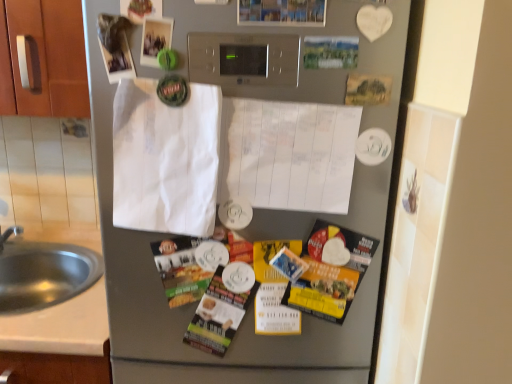
Question: Can you confirm if yellow paper flyer at lower right is taller than brushed metal sink at lower left?

Choices:
 (A) no
 (B) yes

Answer: (B)

Question: Is yellow paper flyer at lower right looking in the opposite direction of brushed metal sink at lower left?

Choices:
 (A) yes
 (B) no

Answer: (B)

Question: Is yellow paper flyer at lower right to the right of brushed metal sink at lower left from the viewer's perspective?

Choices:
 (A) yes
 (B) no

Answer: (A)

Question: From a real-world perspective, does yellow paper flyer at lower right sit lower than brushed metal sink at lower left?

Choices:
 (A) no
 (B) yes

Answer: (A)

Question: Does yellow paper flyer at lower right have a larger size compared to brushed metal sink at lower left?

Choices:
 (A) yes
 (B) no

Answer: (B)

Question: In terms of width, does matte plastic magazine at center, positioned as the first magazine in right-to-left order, look wider or thinner when compared to matte paper magazine at center, placed as the first magazine when sorted from left to right?

Choices:
 (A) thin
 (B) wide

Answer: (B)

Question: Is matte plastic magazine at center, positioned as the first magazine in right-to-left order, bigger or smaller than matte paper magazine at center, the second magazine when ordered from right to left?

Choices:
 (A) big
 (B) small

Answer: (A)

Question: From the image's perspective, is matte plastic magazine at center, marked as the second magazine in a left-to-right arrangement, positioned above or below matte paper magazine at center, placed as the first magazine when sorted from left to right?

Choices:
 (A) below
 (B) above

Answer: (A)

Question: From a real-world perspective, is matte plastic magazine at center, marked as the second magazine in a left-to-right arrangement, above or below matte paper magazine at center, the second magazine when ordered from right to left?

Choices:
 (A) below
 (B) above

Answer: (A)

Question: Considering the positions of yellow paper flyer at lower right and brushed metal sink at lower left in the image, is yellow paper flyer at lower right taller or shorter than brushed metal sink at lower left?

Choices:
 (A) short
 (B) tall

Answer: (B)

Question: Do you think yellow paper flyer at lower right is within brushed metal sink at lower left, or outside of it?

Choices:
 (A) outside
 (B) inside

Answer: (A)

Question: From a real-world perspective, is yellow paper flyer at lower right physically located above or below brushed metal sink at lower left?

Choices:
 (A) above
 (B) below

Answer: (A)

Question: Looking at their shapes, would you say yellow paper flyer at lower right is wider or thinner than brushed metal sink at lower left?

Choices:
 (A) thin
 (B) wide

Answer: (A)

Question: Considering their positions, is matte plastic magazine at center, positioned as the first magazine in right-to-left order, located in front of or behind satin silver refrigerator at center?

Choices:
 (A) behind
 (B) front

Answer: (A)

Question: Considering the positions of point (209, 334) and point (355, 311), is point (209, 334) closer or farther from the camera than point (355, 311)?

Choices:
 (A) closer
 (B) farther

Answer: (B)